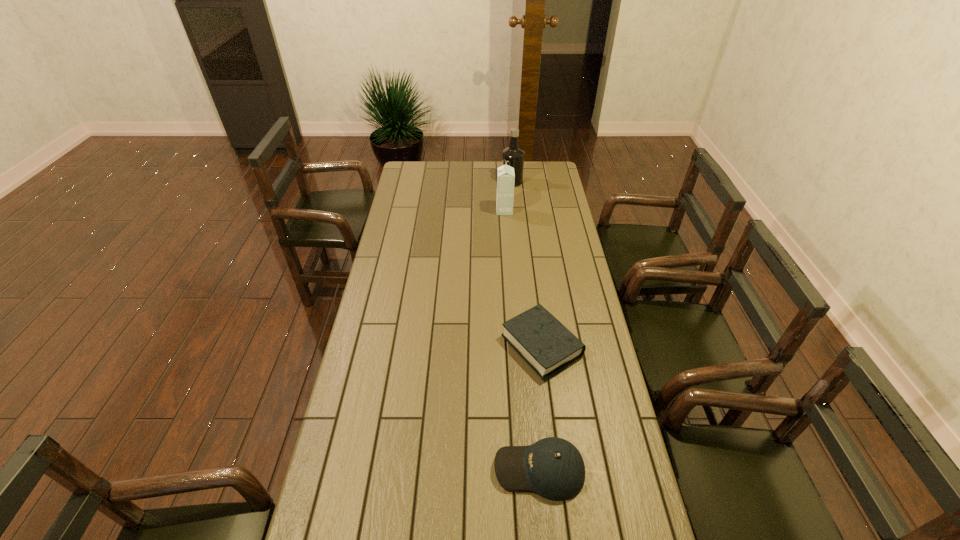
Find the location of a particular element. The height and width of the screenshot is (540, 960). free space located on the front label of the liquor is located at coordinates (444, 181).

Image resolution: width=960 pixels, height=540 pixels. What are the coordinates of `free location located 0.080m on the front label of the second farthest object` in the screenshot? It's located at (480, 211).

I want to click on vacant point located 0.350m on the front label of the second farthest object, so click(424, 211).

Find the location of a particular element. free space located 0.260m on the front label of the second farthest object is located at coordinates [x=444, y=211].

The width and height of the screenshot is (960, 540). In order to click on vacant space located 0.240m on the front-facing side of the third tallest object in this screenshot , I will do `click(408, 469)`.

At what (x,y) coordinates should I click in order to perform the action: click on vacant space situated 0.270m on the front-facing side of the third tallest object. Please return your answer as a coordinate pair (x, y). The height and width of the screenshot is (540, 960). Looking at the image, I should click on (397, 469).

Find the location of a particular element. This screenshot has height=540, width=960. vacant space located 0.140m on the front-facing side of the third tallest object is located at coordinates (444, 469).

You are a GUI agent. You are given a task and a screenshot of the screen. Output one action in this format:
    pyautogui.click(x=<x>, y=<y>)
    Task: Click on the free space located on the back of the second nearest object
    This screenshot has width=960, height=540.
    Given the screenshot: What is the action you would take?
    pyautogui.click(x=537, y=305)

This screenshot has height=540, width=960. Identify the location of object that is at the far edge. (513, 156).

This screenshot has width=960, height=540. I want to click on baseball cap present at the right edge, so click(552, 467).